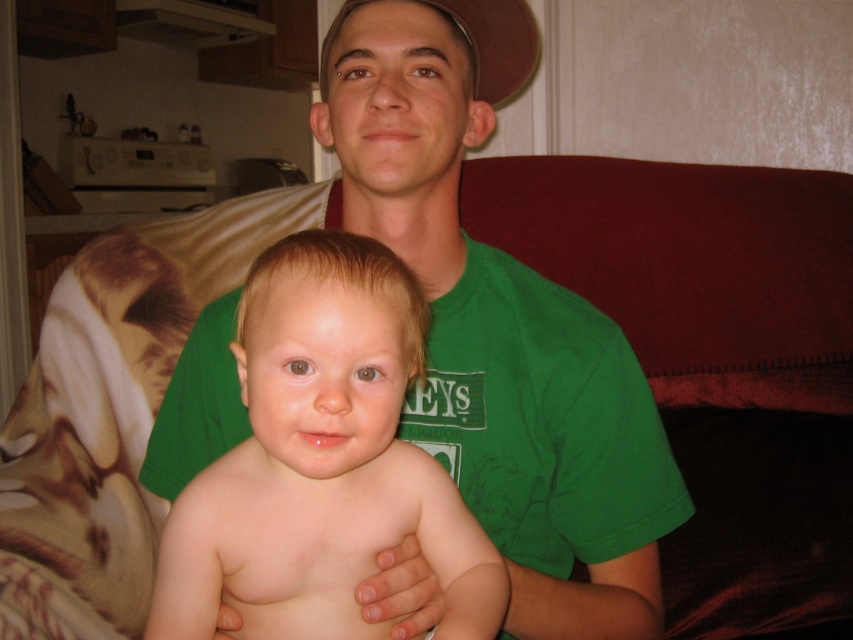
Question: Which object is the farthest from the brown fabric baseball hat at upper center?

Choices:
 (A) green cotton shirt at center
 (B) smooth skin baby at center

Answer: (B)

Question: Can you confirm if green cotton shirt at center is positioned above smooth skin baby at center?

Choices:
 (A) no
 (B) yes

Answer: (B)

Question: Among these objects, which one is nearest to the camera?

Choices:
 (A) brown fabric baseball hat at upper center
 (B) green cotton shirt at center
 (C) smooth skin baby at center

Answer: (C)

Question: Is green cotton shirt at center wider than smooth skin baby at center?

Choices:
 (A) no
 (B) yes

Answer: (B)

Question: Which of the following is the closest to the observer?

Choices:
 (A) green cotton shirt at center
 (B) brown fabric baseball hat at upper center

Answer: (A)

Question: Can you confirm if green cotton shirt at center is thinner than brown fabric baseball hat at upper center?

Choices:
 (A) no
 (B) yes

Answer: (A)